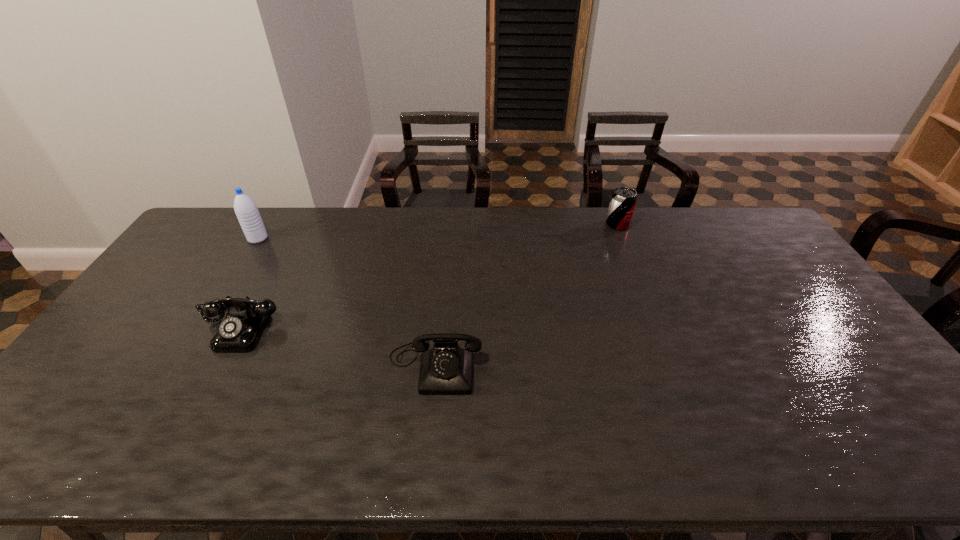
In order to click on water bottle in this screenshot , I will do `click(246, 210)`.

Locate an element on the screen. This screenshot has height=540, width=960. the third nearest object is located at coordinates (246, 210).

I want to click on the farthest object, so click(623, 200).

The width and height of the screenshot is (960, 540). Find the location of `the second tallest object`. the second tallest object is located at coordinates (623, 200).

The image size is (960, 540). In order to click on the third object from left to right in this screenshot , I will do 446,369.

You are a GUI agent. You are given a task and a screenshot of the screen. Output one action in this format:
    pyautogui.click(x=<x>, y=<y>)
    Task: Click on the left telephone
    This screenshot has height=540, width=960.
    Given the screenshot: What is the action you would take?
    pyautogui.click(x=240, y=330)

Where is `vacant space situated on the left of the tallest object`? The height and width of the screenshot is (540, 960). vacant space situated on the left of the tallest object is located at coordinates (234, 239).

You are a GUI agent. You are given a task and a screenshot of the screen. Output one action in this format:
    pyautogui.click(x=<x>, y=<y>)
    Task: Click on the free space located 0.330m on the front of the second tallest object
    The image size is (960, 540).
    Given the screenshot: What is the action you would take?
    pyautogui.click(x=646, y=295)

What are the coordinates of `vacant area located 0.160m on the front face of the third object from left to right` in the screenshot? It's located at 426,458.

You are a GUI agent. You are given a task and a screenshot of the screen. Output one action in this format:
    pyautogui.click(x=<x>, y=<y>)
    Task: Click on the free space located on the dial of the left telephone
    
    Given the screenshot: What is the action you would take?
    pyautogui.click(x=180, y=444)